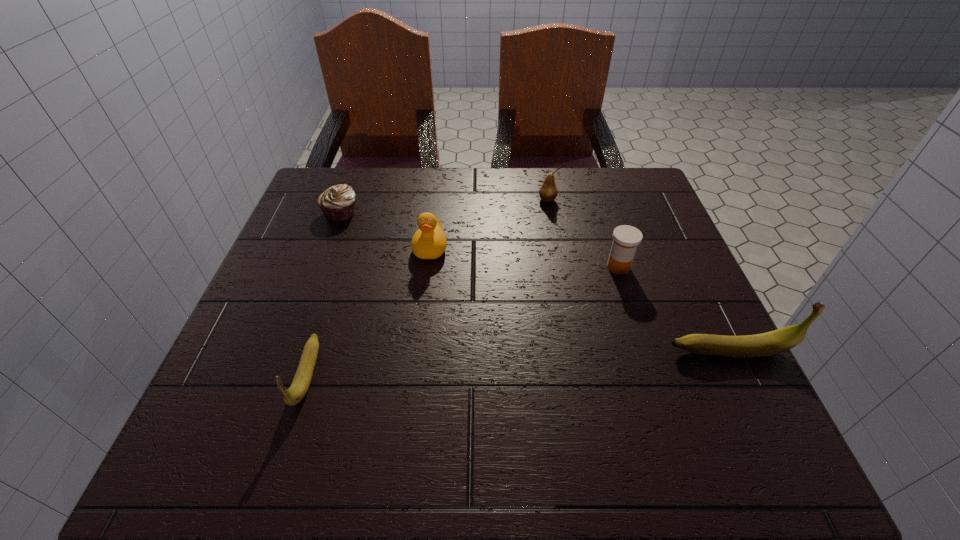
What are the coordinates of `object present at the far left corner` in the screenshot? It's located at (337, 203).

Where is `object present at the near left corner`? object present at the near left corner is located at coordinates (300, 384).

This screenshot has width=960, height=540. What are the coordinates of `free space at the far edge of the desktop` in the screenshot? It's located at (489, 194).

I want to click on free region at the near edge, so click(x=371, y=384).

The width and height of the screenshot is (960, 540). What are the coordinates of `vacant space at the right edge of the desktop` in the screenshot? It's located at (672, 355).

This screenshot has width=960, height=540. Find the location of `vacant space at the far left corner`. vacant space at the far left corner is located at coordinates (372, 178).

In order to click on vacant point at the far right corner in this screenshot , I will do `click(638, 173)`.

The image size is (960, 540). I want to click on free space at the near right corner, so (699, 413).

Find the location of a particular element. The image size is (960, 540). vacant space that's between the third object from left to right and the left banana is located at coordinates (369, 311).

The height and width of the screenshot is (540, 960). In order to click on vacant area between the third object from left to right and the second object from right to left in this screenshot , I will do `click(524, 257)`.